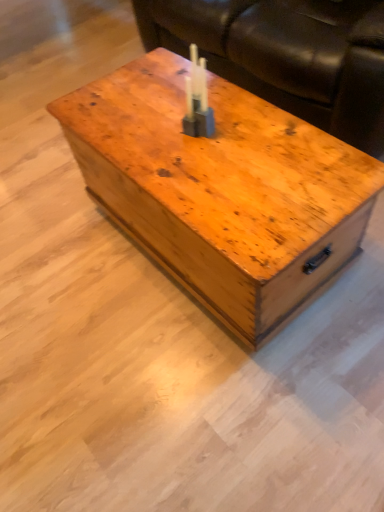
Find the location of a particular element. vacant space that is to the left of wooden chest at center is located at coordinates (66, 272).